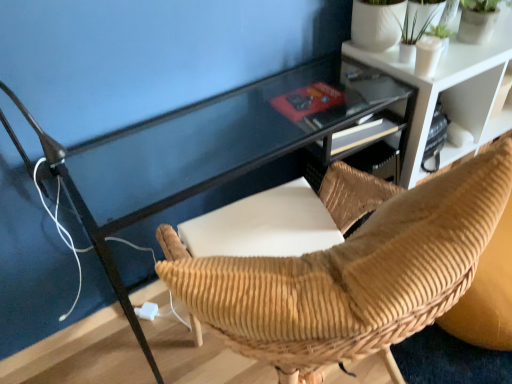
Question: Considering the relative sizes of brown corduroy chair at center and white plastic plug at lower center in the image provided, is brown corduroy chair at center thinner than white plastic plug at lower center?

Choices:
 (A) no
 (B) yes

Answer: (A)

Question: Does brown corduroy chair at center turn towards white plastic plug at lower center?

Choices:
 (A) yes
 (B) no

Answer: (A)

Question: From a real-world perspective, is brown corduroy chair at center located higher than white plastic plug at lower center?

Choices:
 (A) yes
 (B) no

Answer: (A)

Question: Is brown corduroy chair at center surrounding white plastic plug at lower center?

Choices:
 (A) no
 (B) yes

Answer: (A)

Question: Considering the relative sizes of brown corduroy chair at center and white plastic plug at lower center in the image provided, is brown corduroy chair at center bigger than white plastic plug at lower center?

Choices:
 (A) yes
 (B) no

Answer: (A)

Question: Considering the positions of white plastic plug at lower center and white textured shelf at upper right in the image, is white plastic plug at lower center bigger or smaller than white textured shelf at upper right?

Choices:
 (A) small
 (B) big

Answer: (A)

Question: Is white plastic plug at lower center wider or thinner than white textured shelf at upper right?

Choices:
 (A) wide
 (B) thin

Answer: (B)

Question: Based on their positions, is white plastic plug at lower center located to the left or right of white textured shelf at upper right?

Choices:
 (A) right
 (B) left

Answer: (B)

Question: From the image's perspective, is white plastic plug at lower center above or below white textured shelf at upper right?

Choices:
 (A) above
 (B) below

Answer: (B)

Question: Is brown corduroy chair at center in front of or behind white plastic plug at lower center in the image?

Choices:
 (A) front
 (B) behind

Answer: (A)

Question: Based on their positions, is brown corduroy chair at center located to the left or right of white plastic plug at lower center?

Choices:
 (A) left
 (B) right

Answer: (B)

Question: Is brown corduroy chair at center inside or outside of white plastic plug at lower center?

Choices:
 (A) inside
 (B) outside

Answer: (B)

Question: From the image's perspective, is brown corduroy chair at center positioned above or below white plastic plug at lower center?

Choices:
 (A) above
 (B) below

Answer: (A)

Question: Considering the positions of brown corduroy chair at center and green matte plant at upper right in the image, is brown corduroy chair at center taller or shorter than green matte plant at upper right?

Choices:
 (A) tall
 (B) short

Answer: (A)

Question: In terms of size, does brown corduroy chair at center appear bigger or smaller than green matte plant at upper right?

Choices:
 (A) small
 (B) big

Answer: (B)